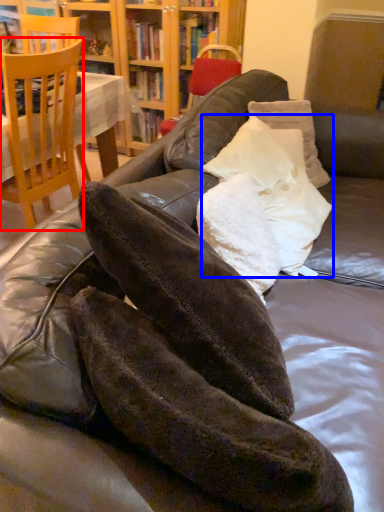
Question: Which point is closer to the camera, chair (highlighted by a red box) or pillow (highlighted by a blue box)?

Choices:
 (A) chair
 (B) pillow

Answer: (B)